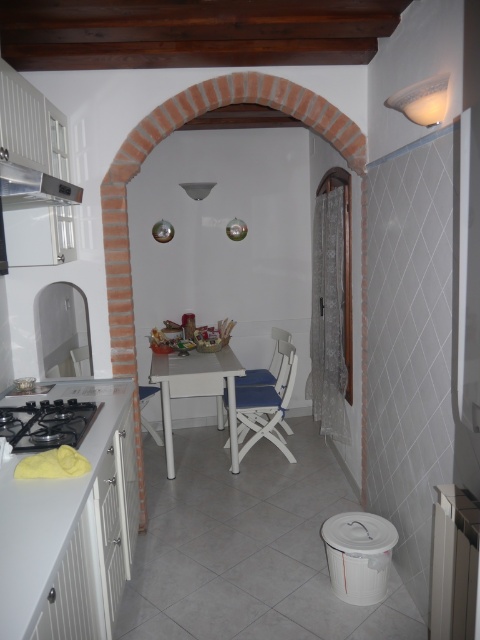
You are planning to place a large rectangular cake on the white glossy table at center. The cake is 1.2 meters long. Considering the size of the table and chair, will the cake fit on the table without touching the blue fabric chair at center?

The white glossy table at center is larger in size than the blue fabric chair at center. Since the table is bigger, it should have enough space to accommodate the 1.2 meter cake without it touching the chair.

You are standing in the kitchen and want to sit down at the blue fabric chair at center. Based on the coordinates provided, can you determine if the chair is positioned centrally in the room?

The blue fabric chair at center is located at point coordinates, which suggests it is positioned centrally in the room as per the given coordinates.